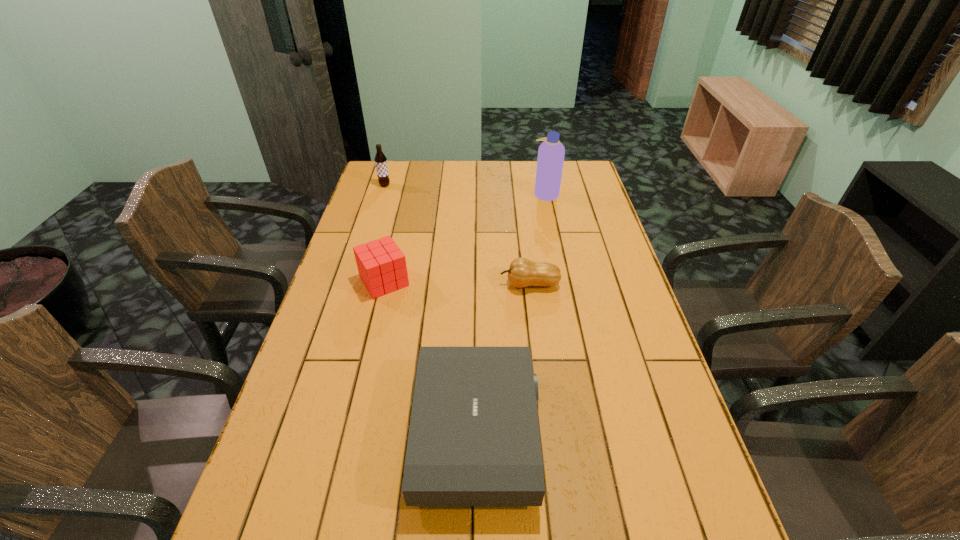
The width and height of the screenshot is (960, 540). What are the coordinates of `free space located on the stem side of the shortest object` in the screenshot? It's located at (458, 284).

The width and height of the screenshot is (960, 540). Identify the location of free space located 0.330m on the stem side of the shortest object. (393, 284).

Find the location of a particular element. shampoo located in the far edge section of the desktop is located at coordinates (551, 152).

This screenshot has height=540, width=960. In order to click on root beer positioned at the far edge in this screenshot , I will do `click(380, 159)`.

Find the location of a particular element. This screenshot has height=540, width=960. root beer that is at the left edge is located at coordinates 380,159.

This screenshot has height=540, width=960. Identify the location of cube at the left edge. (381, 264).

I want to click on object at the right edge, so click(x=551, y=152).

At what (x,y) coordinates should I click in order to perform the action: click on object that is at the far left corner. Please return your answer as a coordinate pair (x, y). Image resolution: width=960 pixels, height=540 pixels. Looking at the image, I should click on (380, 159).

The width and height of the screenshot is (960, 540). I want to click on object that is at the far right corner, so click(551, 152).

Where is `vacant space at the far edge of the desktop`? The width and height of the screenshot is (960, 540). vacant space at the far edge of the desktop is located at coordinates (447, 170).